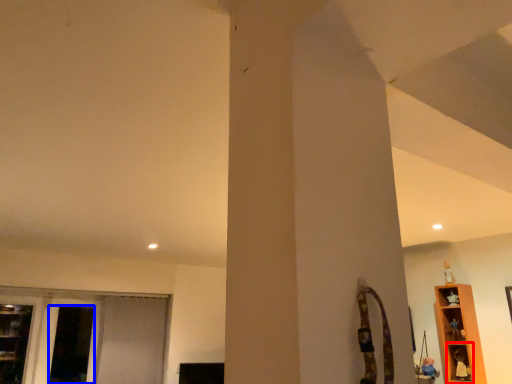
Question: Which object is further to the camera taking this photo, shelf (highlighted by a red box) or screen door (highlighted by a blue box)?

Choices:
 (A) shelf
 (B) screen door

Answer: (B)